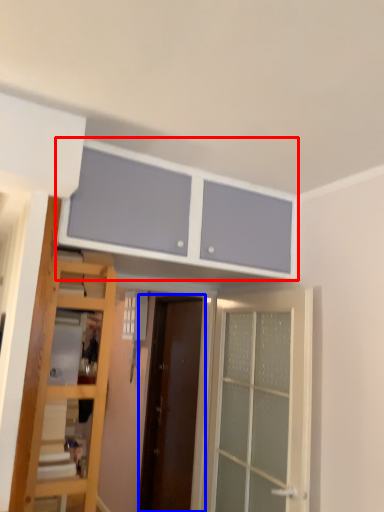
Question: Which object appears closest to the camera in this image, cabinetry (highlighted by a red box) or door (highlighted by a blue box)?

Choices:
 (A) cabinetry
 (B) door

Answer: (A)